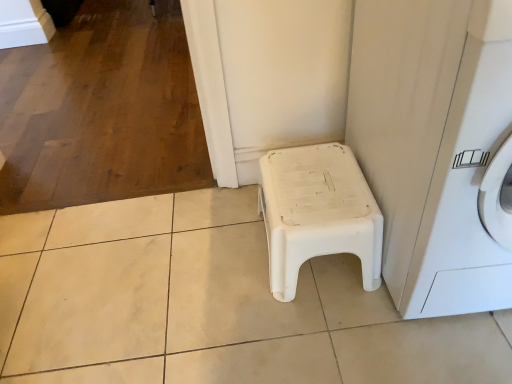
Measure the distance between point (x=425, y=271) and camera.

Point (x=425, y=271) and camera are 34.33 inches apart.

Image resolution: width=512 pixels, height=384 pixels. What do you see at coordinates (467, 183) in the screenshot?
I see `white plastic washing machine at lower right` at bounding box center [467, 183].

At what (x,y) coordinates should I click in order to perform the action: click on white plastic washing machine at lower right. Please return your answer as a coordinate pair (x, y). This screenshot has width=512, height=384. Looking at the image, I should click on pos(467,183).

I want to click on white plastic stool at center, so click(317, 213).

This screenshot has height=384, width=512. Describe the element at coordinates (317, 213) in the screenshot. I see `white plastic stool at center` at that location.

Identify the location of white plastic washing machine at lower right. (467, 183).

Is white plastic washing machine at lower right at the right side of white plastic stool at center?

Yes, white plastic washing machine at lower right is to the right of white plastic stool at center.

Is the position of white plastic washing machine at lower right more distant than that of white plastic stool at center?

No, white plastic washing machine at lower right is closer to the camera.

Which is behind, point (445, 201) or point (298, 238)?

The point (298, 238) is farther.

From the image's perspective, which one is positioned higher, white plastic washing machine at lower right or white plastic stool at center?

From the image's view, white plastic washing machine at lower right is above.

From a real-world perspective, is white plastic washing machine at lower right physically below white plastic stool at center?

Actually, white plastic washing machine at lower right is physically above white plastic stool at center in the real world.

Between white plastic washing machine at lower right and white plastic stool at center, which one has smaller width?

Thinner between the two is white plastic stool at center.

Is white plastic washing machine at lower right taller than white plastic stool at center?

Indeed, white plastic washing machine at lower right has a greater height compared to white plastic stool at center.

Is white plastic washing machine at lower right bigger than white plastic stool at center?

Yes.

Can we say white plastic washing machine at lower right lies outside white plastic stool at center?

Yes, white plastic washing machine at lower right is outside of white plastic stool at center.

Is white plastic washing machine at lower right next to white plastic stool at center and touching it?

No.

Is white plastic washing machine at lower right looking in the opposite direction of white plastic stool at center?

No, white plastic washing machine at lower right's orientation is not away from white plastic stool at center.

How many degrees apart are the facing directions of white plastic washing machine at lower right and white plastic stool at center?

0.81 degrees separate the facing orientations of white plastic washing machine at lower right and white plastic stool at center.

How much distance is there between white plastic washing machine at lower right and white plastic stool at center?

white plastic washing machine at lower right is 11.27 inches away from white plastic stool at center.

Find the location of a particular element. washing machine above the white plastic stool at center (from the image's perspective) is located at coordinates (467, 183).

Considering the relative positions of white plastic stool at center and white plastic washing machine at lower right in the image provided, is white plastic stool at center to the left of white plastic washing machine at lower right from the viewer's perspective?

Correct, you'll find white plastic stool at center to the left of white plastic washing machine at lower right.

Which object is further away from the camera, white plastic stool at center or white plastic washing machine at lower right?

white plastic stool at center is further from the camera.

Does point (315, 195) appear closer or farther from the camera than point (466, 49)?

Clearly, point (315, 195) is more distant from the camera than point (466, 49).

From the image's perspective, is white plastic stool at center beneath white plastic washing machine at lower right?

Yes.

From a real-world perspective, is white plastic stool at center positioned above or below white plastic washing machine at lower right?

Clearly, from a real-world perspective, white plastic stool at center is below white plastic washing machine at lower right.

Which of these two, white plastic stool at center or white plastic washing machine at lower right, is wider?

white plastic washing machine at lower right.

Looking at this image, considering the relative sizes of white plastic stool at center and white plastic washing machine at lower right in the image provided, is white plastic stool at center shorter than white plastic washing machine at lower right?

Yes, white plastic stool at center is shorter than white plastic washing machine at lower right.

Is white plastic stool at center smaller than white plastic washing machine at lower right?

Yes.

Is white plastic stool at center outside of white plastic washing machine at lower right?

Indeed, white plastic stool at center is completely outside white plastic washing machine at lower right.

Is white plastic stool at center next to white plastic washing machine at lower right and touching it?

No.

Is white plastic stool at center turned away from white plastic washing machine at lower right?

No, white plastic stool at center's orientation is not away from white plastic washing machine at lower right.

Measure the distance between white plastic stool at center and white plastic washing machine at lower right.

11.27 inches.

In order to click on furniture that is below the white plastic washing machine at lower right (from the image's perspective) in this screenshot , I will do `click(317, 213)`.

Identify the location of washing machine to the right of white plastic stool at center. 467,183.

I want to click on washing machine in front of the white plastic stool at center, so click(467, 183).